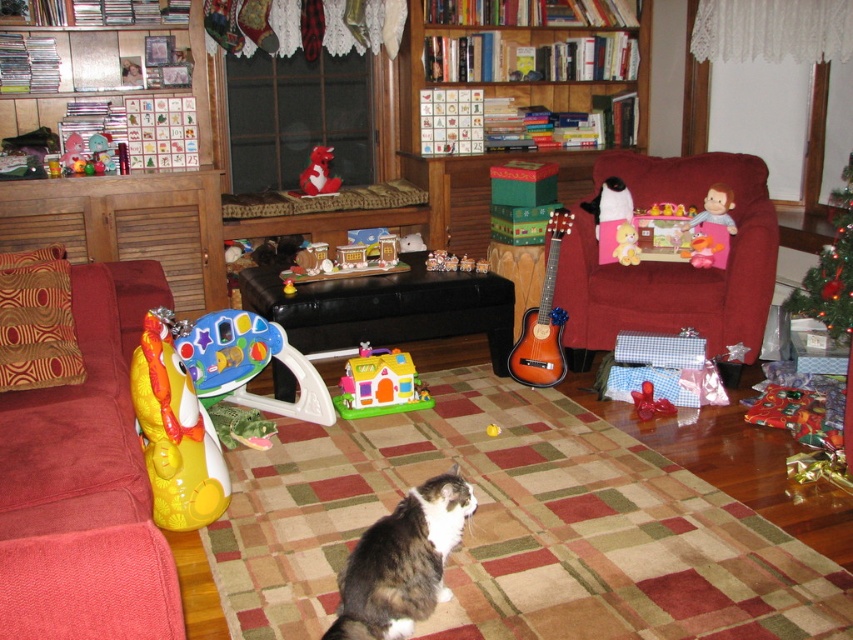
Is point (454, 497) farther from camera compared to point (282, 364)?

That is False.

Between gray fluffy cat at center and matte plastic walker at center, which one appears on the right side from the viewer's perspective?

From the viewer's perspective, gray fluffy cat at center appears more on the right side.

Where is `gray fluffy cat at center`? gray fluffy cat at center is located at coordinates (402, 561).

Which of these two, wooden bookshelf at upper center or yellow rubber duck at left, stands taller?

wooden bookshelf at upper center

Is wooden bookshelf at upper center below yellow rubber duck at left?

No, wooden bookshelf at upper center is not below yellow rubber duck at left.

Which is behind, point (413, 68) or point (206, 522)?

Point (413, 68)

Find the location of a particular element. wooden bookshelf at upper center is located at coordinates (498, 152).

Does point (461, 180) come behind point (231, 348)?

Yes, point (461, 180) is behind point (231, 348).

This screenshot has height=640, width=853. What do you see at coordinates (498, 152) in the screenshot?
I see `wooden bookshelf at upper center` at bounding box center [498, 152].

You are a GUI agent. You are given a task and a screenshot of the screen. Output one action in this format:
    pyautogui.click(x=<x>, y=<y>)
    Task: Click on the wooden bookshelf at upper center
    Image resolution: width=853 pixels, height=640 pixels.
    Given the screenshot: What is the action you would take?
    pyautogui.click(x=498, y=152)